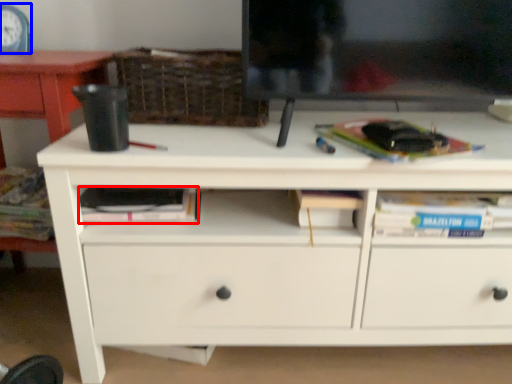
Question: Among these objects, which one is farthest to the camera, paperback book (highlighted by a red box) or clock (highlighted by a blue box)?

Choices:
 (A) paperback book
 (B) clock

Answer: (B)